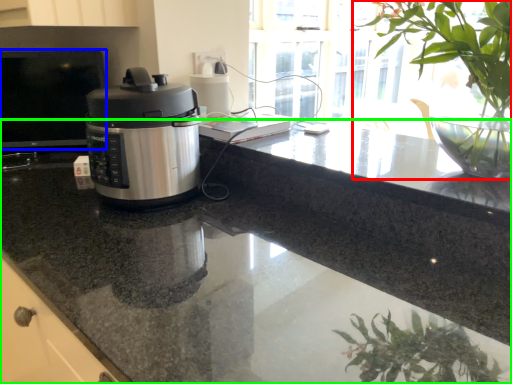
Question: Estimate the real-world distances between objects in this image. Which object is farther from houseplant (highlighted by a red box), desktop (highlighted by a blue box) or countertop (highlighted by a green box)?

Choices:
 (A) desktop
 (B) countertop

Answer: (A)